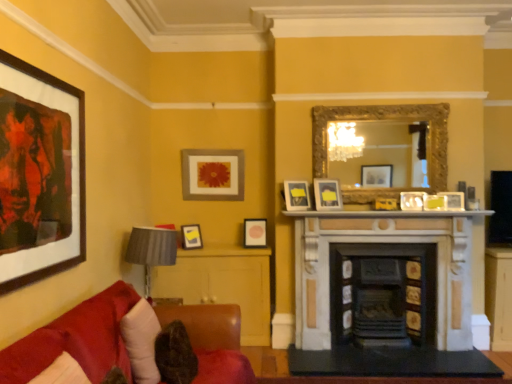
Where is `free location in front of matte black picture frame at center, the 5th picture frame viewed from the right`? free location in front of matte black picture frame at center, the 5th picture frame viewed from the right is located at coordinates (256, 246).